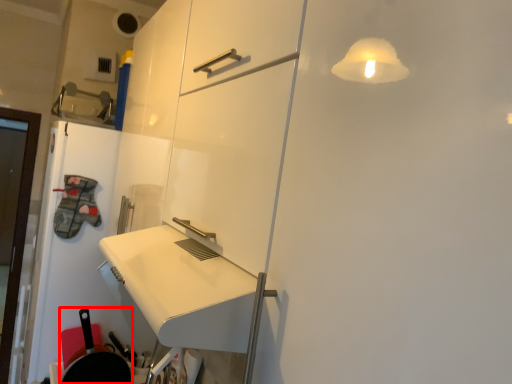
Question: From the image's perspective, where is frying pan (annotated by the red box) located relative to door?

Choices:
 (A) below
 (B) above

Answer: (A)